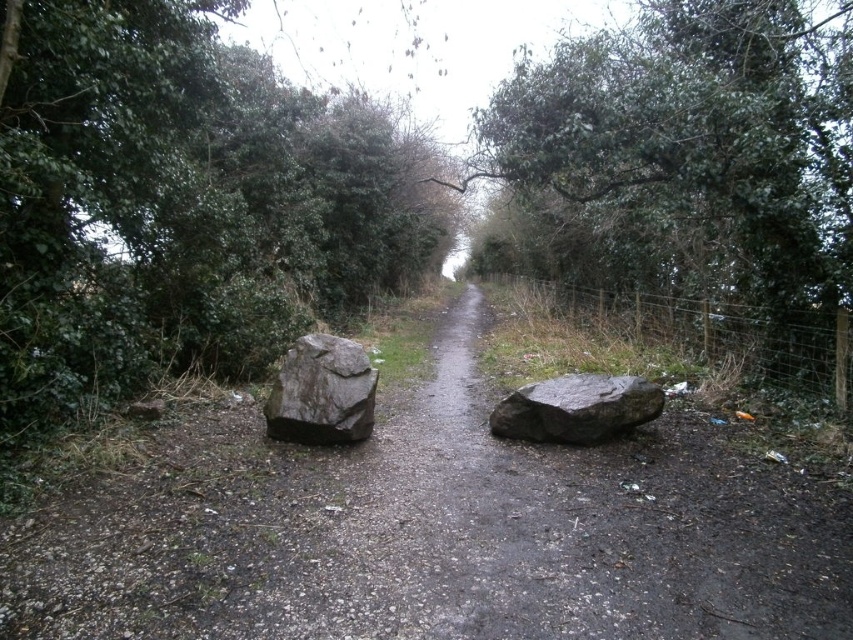
You are a hiker carrying a large backpack and need to navigate the narrow path. You notice the green leafy tree at left and the gray rough rock at center. Which object is closer to the path, and would it be easier to avoid while walking?

The gray rough rock at center is closer to the path than the green leafy tree at left. Since the rock is at the center of the path, it would be harder to avoid, while the tree is on the left side, so you can walk around it more easily.

You are standing at the starting point of the path and want to reach the end of the path. Which of the two points, point (x=415, y=196) or point (x=317, y=394), is closer to your current position?

Point (x=317, y=394) is closer to your current position because it is in front of point (x=415, y=196).

You are standing at the starting point of the path and want to reach the green leafy tree at center. Based on the coordinates provided, in which direction should you walk to reach the tree?

The green leafy tree at center is located at coordinates point (689, 164), which means it is positioned to the left and ahead of your current position at the start of the path. You should walk towards the left and forward along the path to reach the tree.